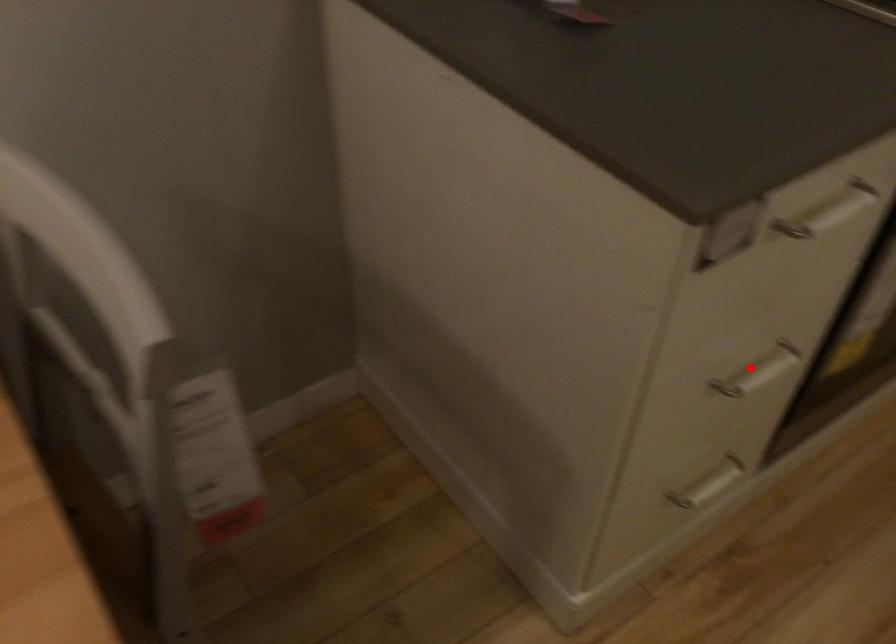
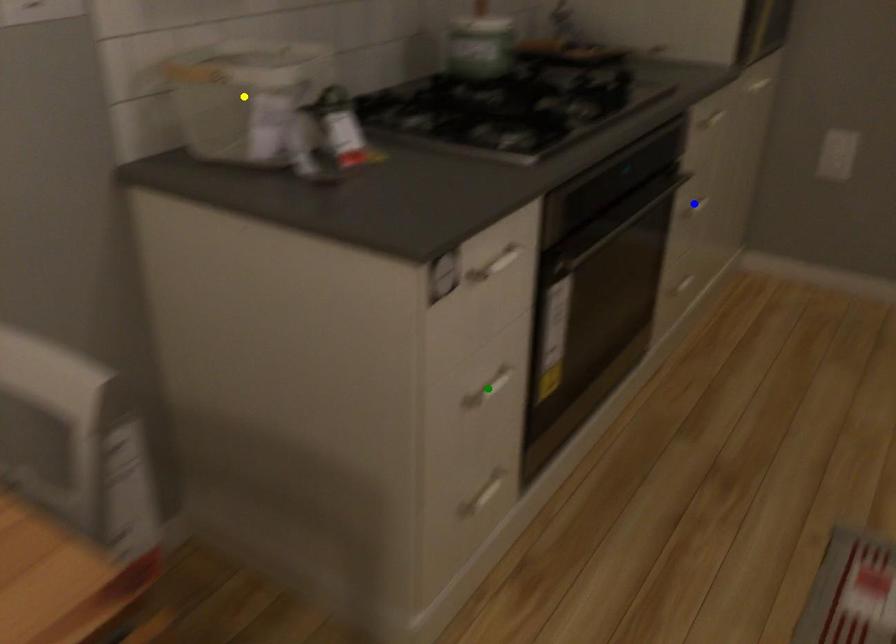
Question: I am providing you with two images of the same scene from different viewpoints. A red point is marked on the first image. You are given multiple points on the second image. Which point in image 2 is actually the same real-world point as the red point in image 1?

Choices:
 (A) blue point
 (B) green point
 (C) yellow point

Answer: (B)